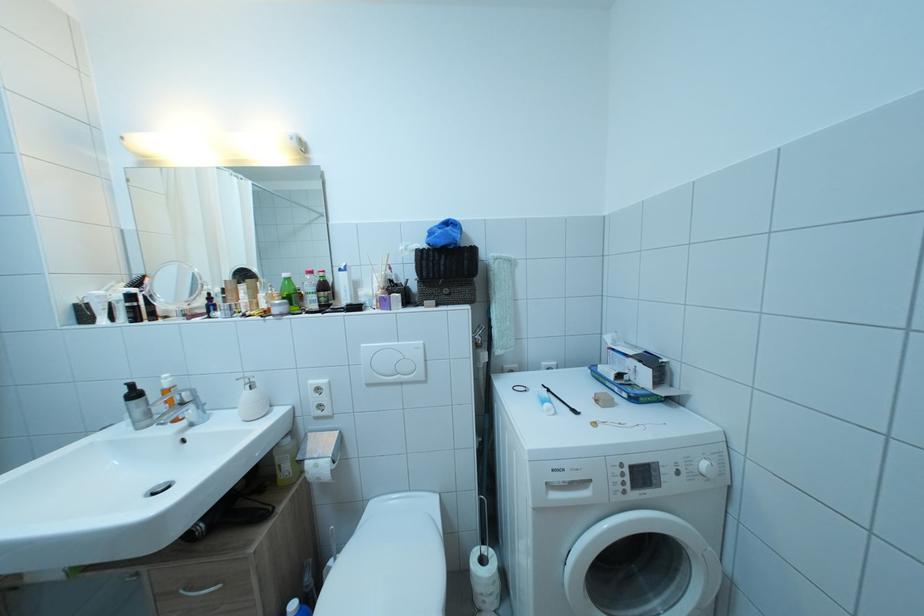
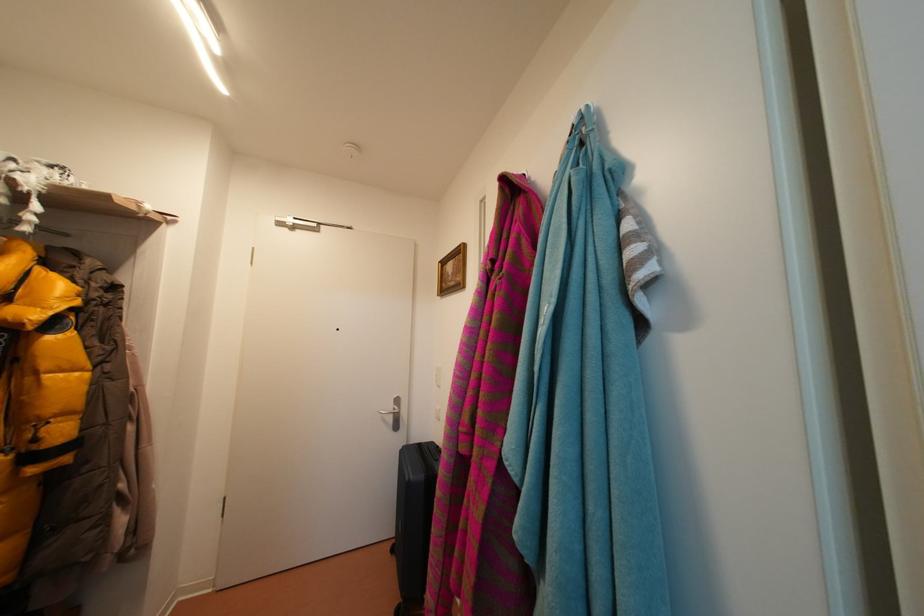
Question: The images are taken continuously from a first-person perspective. In which direction is your viewpoint rotating?

Choices:
 (A) Left
 (B) Right
 (C) Up
 (D) Down

Answer: (B)